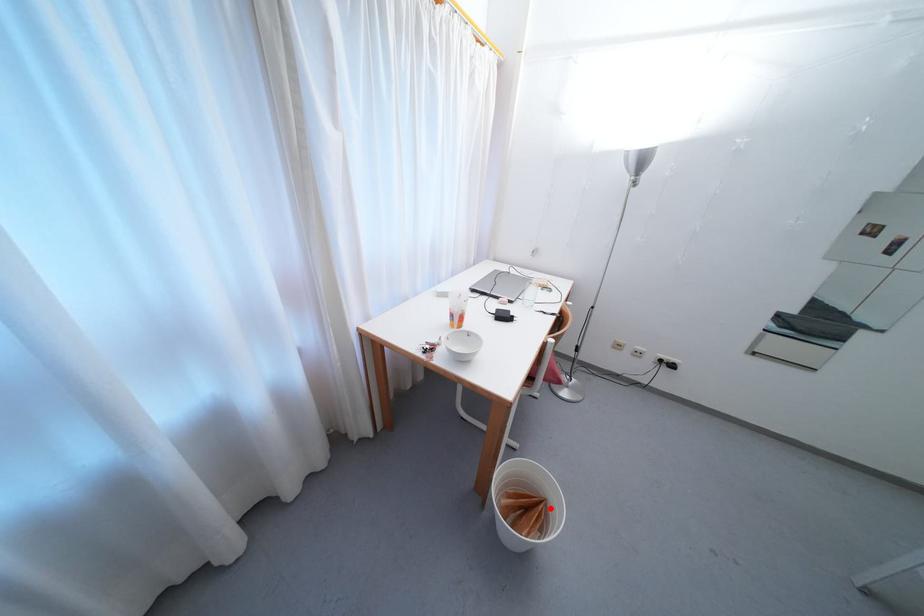
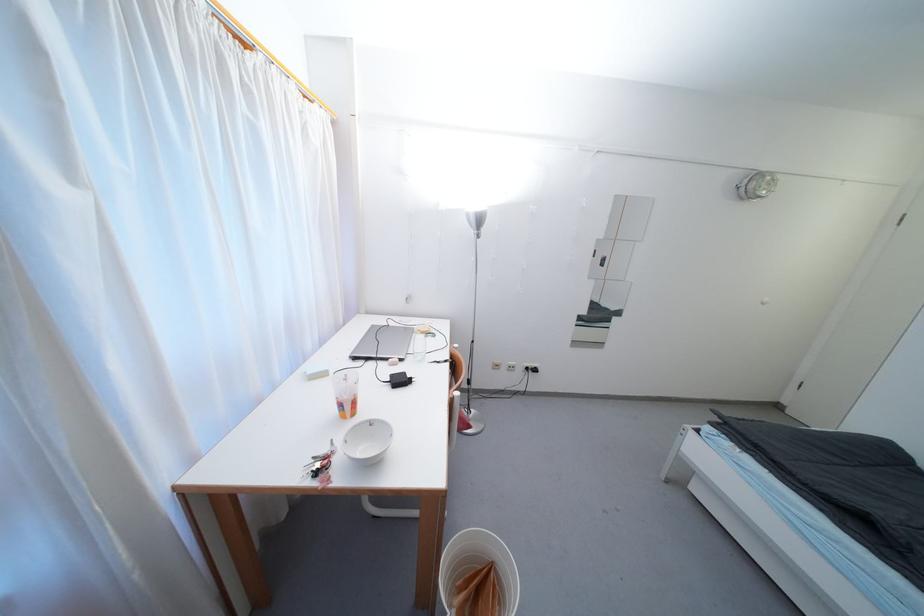
Question: I am providing you with two images of the same scene from different viewpoints. Given a red point in image1, look at the same physical point in image2. Is it:

Choices:
 (A) Closer to the viewpoint
 (B) Farther from the viewpoint

Answer: (B)